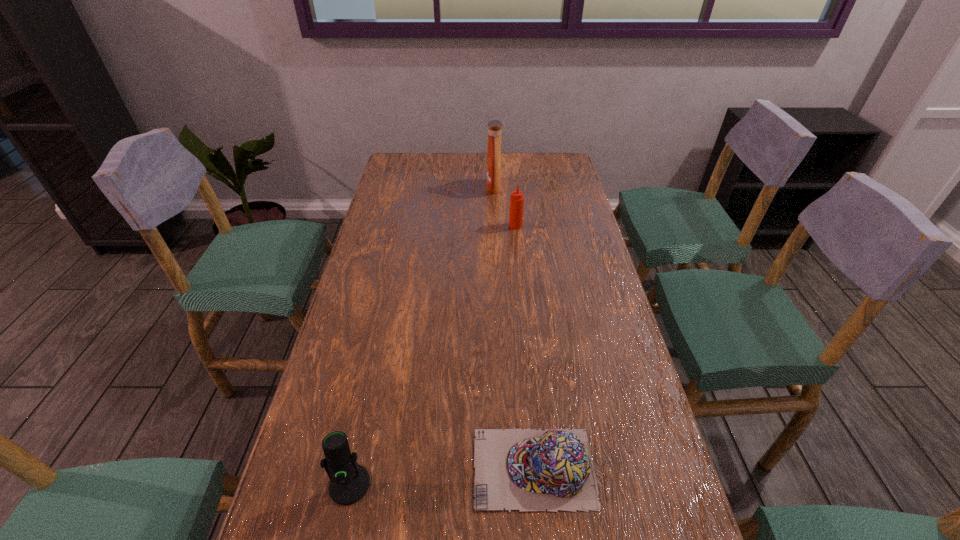
The width and height of the screenshot is (960, 540). Find the location of `the tallest object`. the tallest object is located at coordinates (494, 126).

This screenshot has width=960, height=540. Find the location of `the farthest object`. the farthest object is located at coordinates (494, 126).

Find the location of `Tabasco sauce`. Tabasco sauce is located at coordinates (516, 199).

The height and width of the screenshot is (540, 960). I want to click on microphone, so click(x=349, y=481).

Identify the location of cap. The image size is (960, 540). (527, 470).

At what (x,y) coordinates should I click in order to perform the action: click on free region located 0.220m on the front-facing side of the tallest object. Please return your answer as a coordinate pair (x, y). This screenshot has width=960, height=540. Looking at the image, I should click on (428, 187).

Where is `vacant space located 0.170m on the front-facing side of the tallest object`? Image resolution: width=960 pixels, height=540 pixels. vacant space located 0.170m on the front-facing side of the tallest object is located at coordinates (442, 187).

Where is `vacant space located on the front-facing side of the tallest object`? Image resolution: width=960 pixels, height=540 pixels. vacant space located on the front-facing side of the tallest object is located at coordinates (431, 187).

In order to click on free space located 0.130m on the right of the second farthest object in this screenshot , I will do [561, 226].

Where is `vacant space located on the right of the microphone`? This screenshot has height=540, width=960. vacant space located on the right of the microphone is located at coordinates (504, 484).